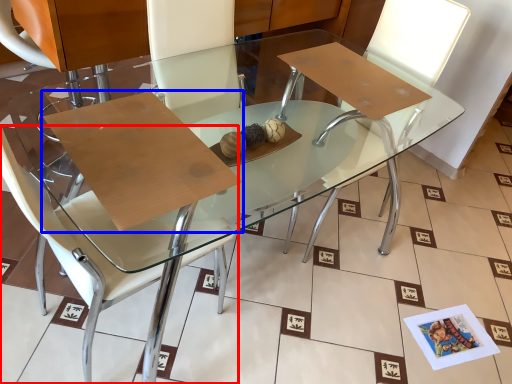
Question: Among these objects, which one is nearest to the camera, chair (highlighted by a red box) or cardboard (highlighted by a blue box)?

Choices:
 (A) chair
 (B) cardboard

Answer: (A)